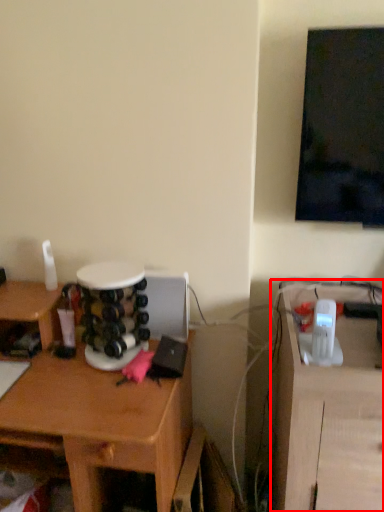
Question: In this image, where is computer desk (annotated by the red box) located relative to desk?

Choices:
 (A) right
 (B) left

Answer: (A)